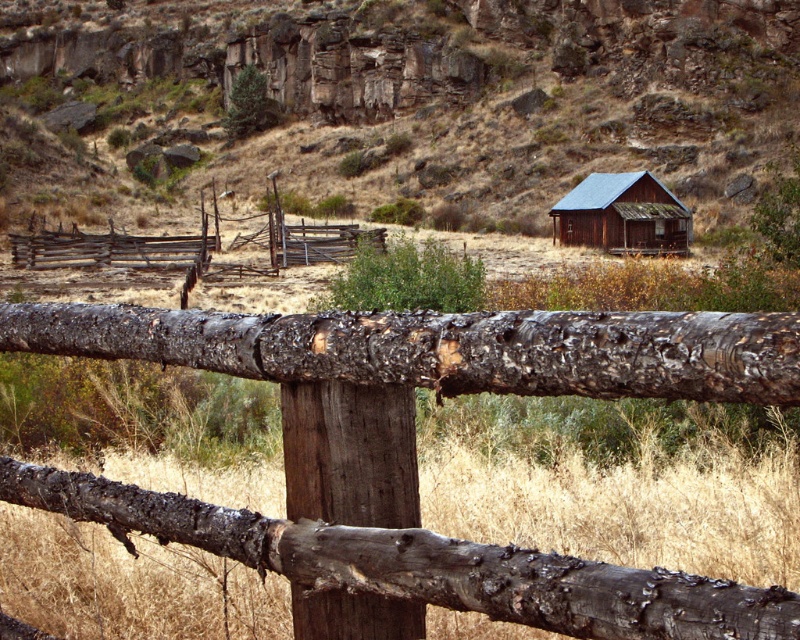
Question: Considering the relative positions of charred wood fence at center and charred wood log at center in the image provided, where is charred wood fence at center located with respect to charred wood log at center?

Choices:
 (A) below
 (B) above

Answer: (A)

Question: Which of the following is the closest to the observer?

Choices:
 (A) (370, 122)
 (B) (188, 248)

Answer: (B)

Question: Which of the following is the closest to the observer?

Choices:
 (A) brown wooden fence at center
 (B) rusty wood cabin at center
 (C) weathered wood fence at center
 (D) charred wood log at center

Answer: (D)

Question: Which point is farther to the camera?

Choices:
 (A) brown wooden fence at center
 (B) weathered wood fence at center

Answer: (A)

Question: Is brown wooden fence at center bigger than weathered wood fence at center?

Choices:
 (A) no
 (B) yes

Answer: (B)

Question: From the image, what is the correct spatial relationship of charred wood fence at center in relation to charred wood log at center?

Choices:
 (A) below
 (B) above

Answer: (A)